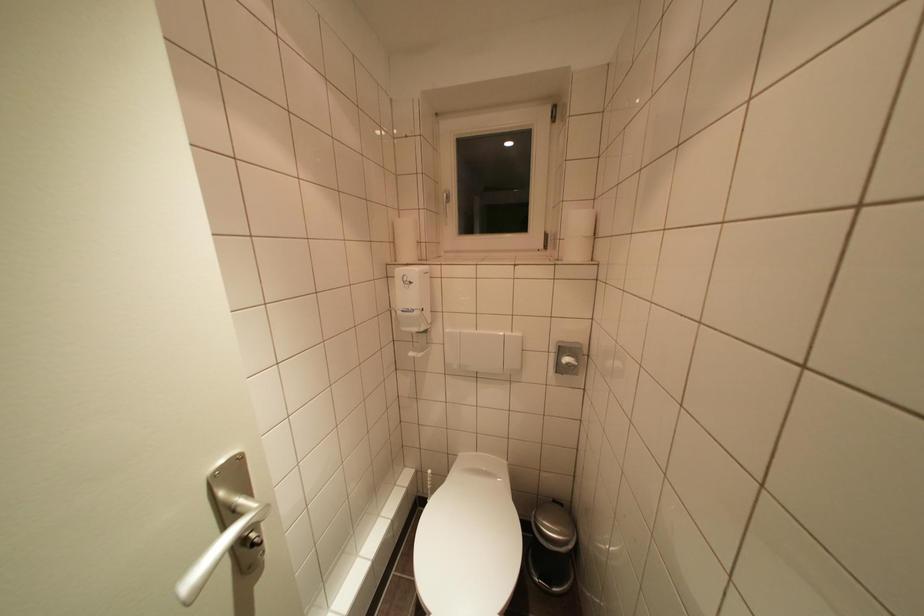
What do you see at coordinates (553, 517) in the screenshot?
I see `the metal trash can pedal` at bounding box center [553, 517].